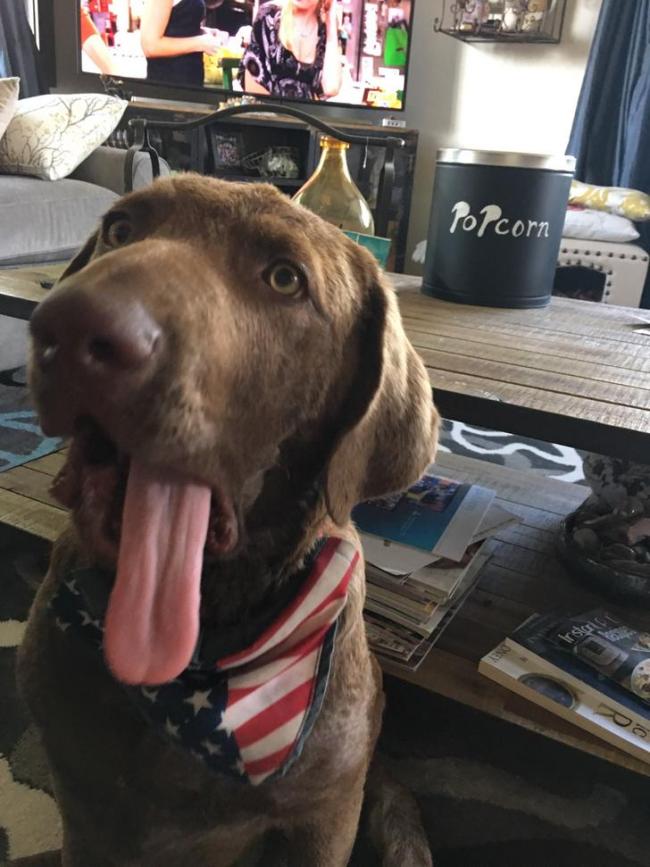
You are a GUI agent. You are given a task and a screenshot of the screen. Output one action in this format:
    pyautogui.click(x=<x>, y=<y>)
    Task: Click on the 2 wooden shelves behind dog
    The width and height of the screenshot is (650, 867).
    Given the screenshot: What is the action you would take?
    pyautogui.click(x=523, y=559), pyautogui.click(x=506, y=355)